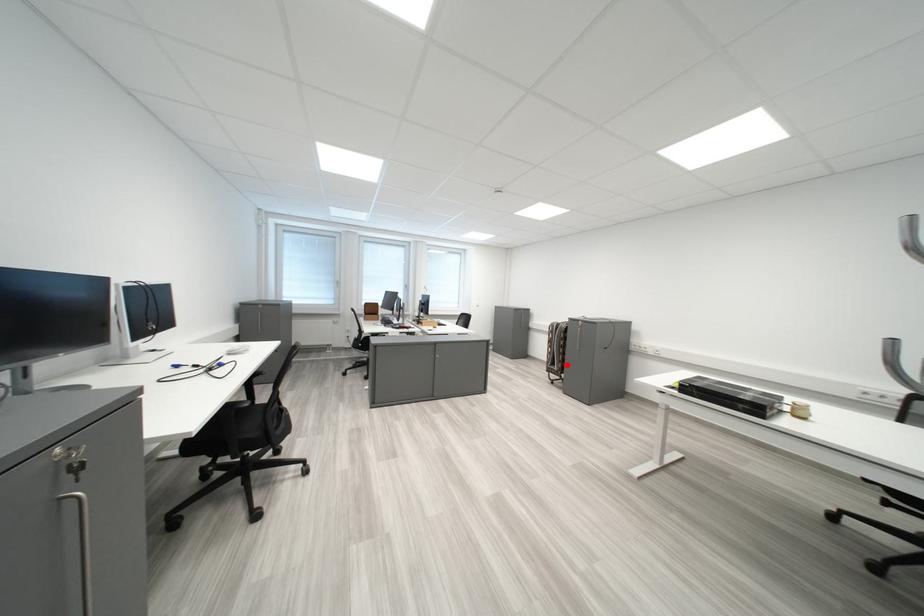
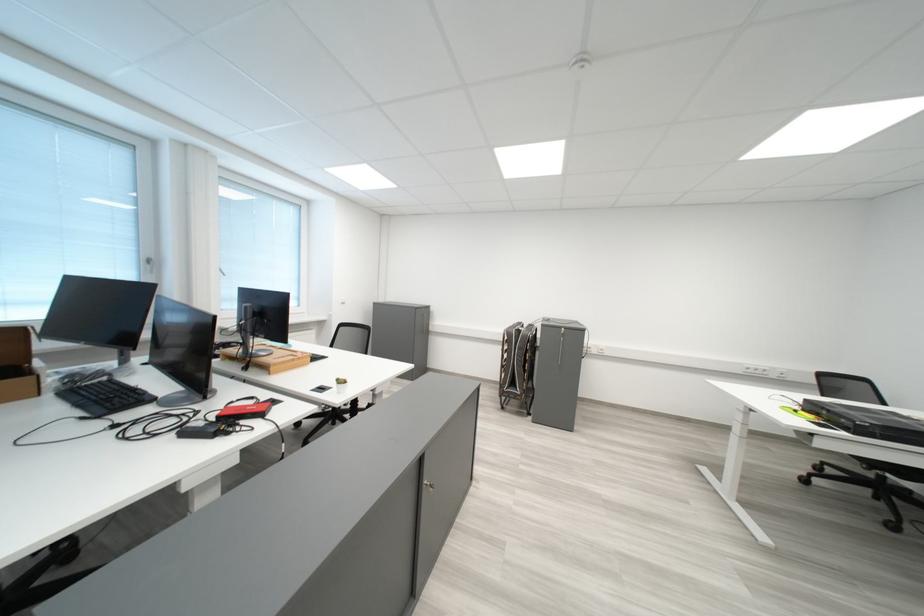
Question: I am providing you with two images of the same scene from different viewpoints. Given a red point in image1, look at the same physical point in image2. Is it:

Choices:
 (A) Closer to the viewpoint
 (B) Farther from the viewpoint

Answer: (B)